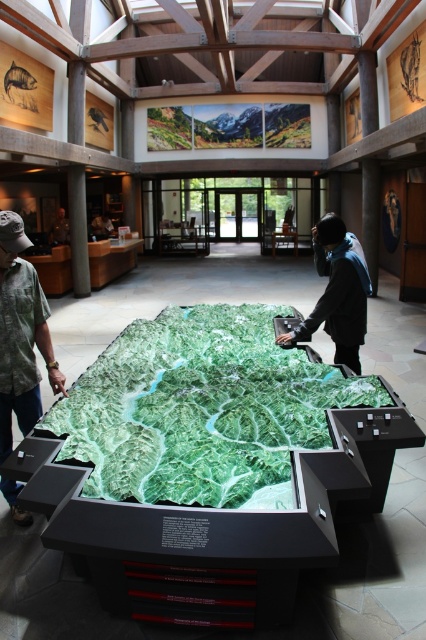
You are a tour guide at the museum and need to ensure that the green camouflage shirt at left and the dark gray jacket at center can both fit through a doorway that is 1.2 meters wide. Based on their sizes, will they be able to pass through comfortably?

The green camouflage shirt at left is narrower than the dark gray jacket at center. Since the doorway is 1.2 meters wide, both individuals should be able to pass through comfortably as their combined width would likely be under the doorway limit.